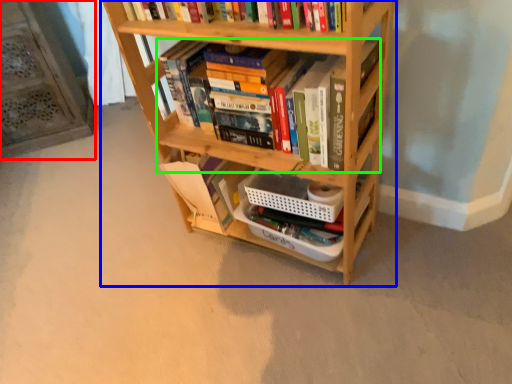
Question: Estimate the real-world distances between objects in this image. Which object is closer to shelf (highlighted by a red box), bookcase (highlighted by a blue box) or book (highlighted by a green box)?

Choices:
 (A) bookcase
 (B) book

Answer: (A)